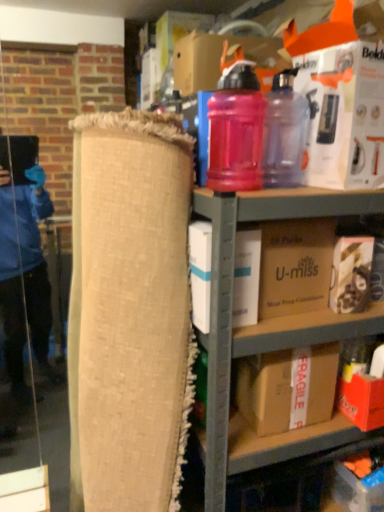
Question: Looking at their shapes, would you say fragile cardboard box at lower right is wider or thinner than white cardboard box at center, acting as the second box starting from the bottom?

Choices:
 (A) thin
 (B) wide

Answer: (A)

Question: Is fragile cardboard box at lower right in front of or behind white cardboard box at center, acting as the second box starting from the bottom, in the image?

Choices:
 (A) front
 (B) behind

Answer: (B)

Question: Considering the real-world distances, which object is farthest from the fragile cardboard box at center, the fifth box in the top-to-bottom sequence?

Choices:
 (A) brown cardboard box at center, which ranks as the 2th box in top-to-bottom order
 (B) fragile cardboard box at lower right
 (C) pink translucent water bottle at upper right, which is the first bottle in right-to-left order
 (D) matte plastic shelf at upper center
 (E) matte brown box at lower right, acting as the third box starting from the top

Answer: (C)

Question: Which object is positioned farthest from the matte brown box at lower right, acting as the third box starting from the top?

Choices:
 (A) white cardboard box at center, acting as the second box starting from the bottom
 (B) fragile cardboard box at lower right
 (C) pink translucent water bottle at upper right, which ranks as the second bottle in left-to-right order
 (D) burlap roll at center
 (E) pink translucent bottle at upper center, which appears as the first bottle when viewed from the left

Answer: (D)